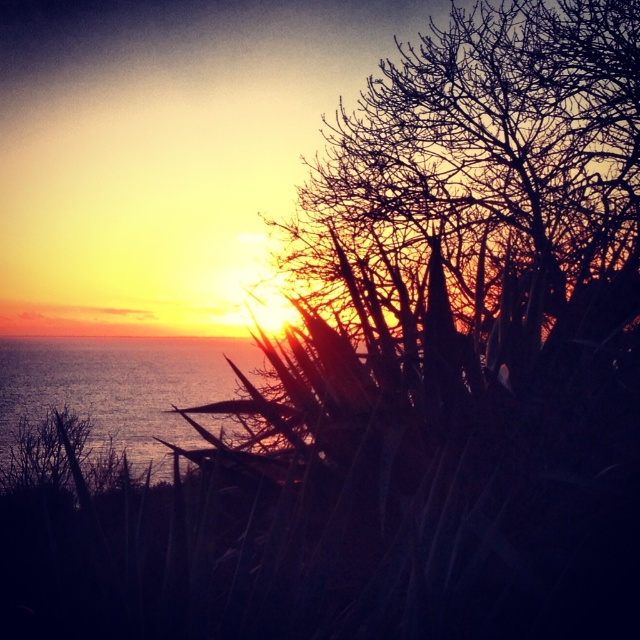
Question: Which point appears closest to the camera in this image?

Choices:
 (A) (336, 218)
 (B) (112, 436)

Answer: (A)

Question: Does bare branches at upper right have a larger size compared to shiny blue water at left?

Choices:
 (A) no
 (B) yes

Answer: (A)

Question: Is bare branches at upper right smaller than shiny blue water at left?

Choices:
 (A) no
 (B) yes

Answer: (B)

Question: Among these points, which one is farthest from the camera?

Choices:
 (A) (588, 109)
 (B) (35, 374)

Answer: (B)

Question: Is bare branches at upper right closer to the viewer compared to shiny blue water at left?

Choices:
 (A) no
 (B) yes

Answer: (B)